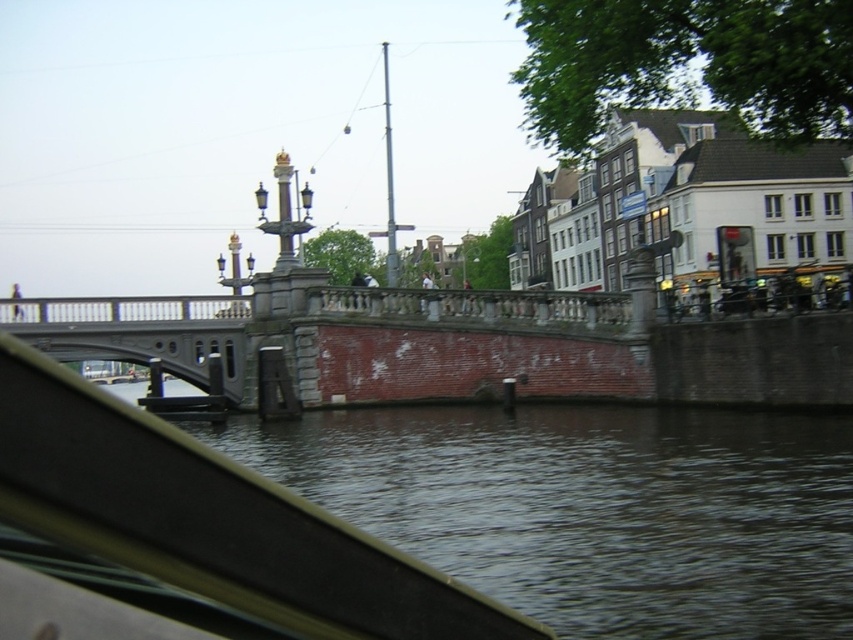
Looking at this image, how distant is dark water at lower center from gray concrete bridge at center?

A distance of 24.28 meters exists between dark water at lower center and gray concrete bridge at center.

Which of these two, dark water at lower center or gray concrete bridge at center, stands taller?

With more height is gray concrete bridge at center.

What do you see at coordinates (593, 508) in the screenshot? The image size is (853, 640). I see `dark water at lower center` at bounding box center [593, 508].

Where is `dark water at lower center`? The image size is (853, 640). dark water at lower center is located at coordinates (593, 508).